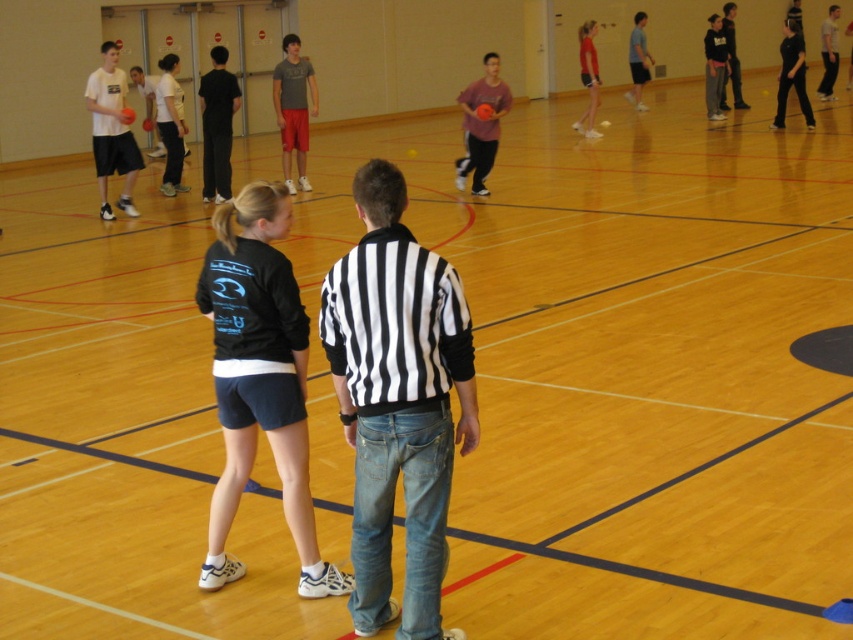
Can you confirm if matte red shirt at upper right is positioned below black cotton hoodie at upper right?

Indeed, matte red shirt at upper right is positioned under black cotton hoodie at upper right.

Is matte red shirt at upper right to the left of black cotton hoodie at upper right from the viewer's perspective?

Yes, matte red shirt at upper right is to the left of black cotton hoodie at upper right.

Between point (595, 109) and point (728, 32), which one is positioned in front?

Point (595, 109)

Find the location of `matte red shirt at upper right`. matte red shirt at upper right is located at coordinates (589, 77).

This screenshot has width=853, height=640. Identify the location of black and white striped shirt at center. (397, 401).

Consider the image. Is black and white striped shirt at center shorter than matte gray t-shirt at center?

Yes, black and white striped shirt at center is shorter than matte gray t-shirt at center.

This screenshot has width=853, height=640. What do you see at coordinates (397, 401) in the screenshot?
I see `black and white striped shirt at center` at bounding box center [397, 401].

What are the coordinates of `black and white striped shirt at center` in the screenshot? It's located at (397, 401).

Does black cotton shirt at lower left appear over matte white t-shirt at left?

No, black cotton shirt at lower left is not above matte white t-shirt at left.

Does point (260, 403) come closer to viewer compared to point (108, 172)?

That is True.

Where is `black cotton shirt at lower left`? black cotton shirt at lower left is located at coordinates (259, 380).